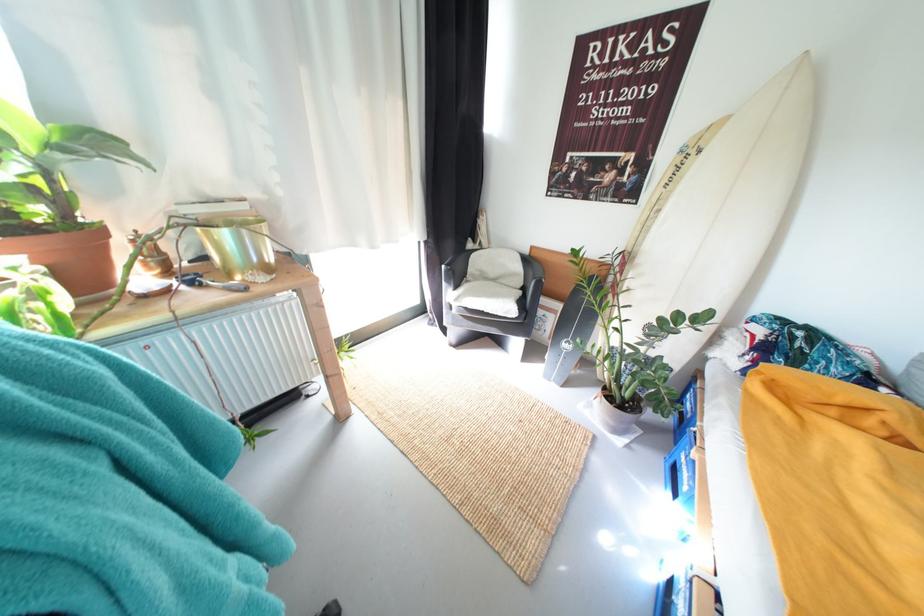
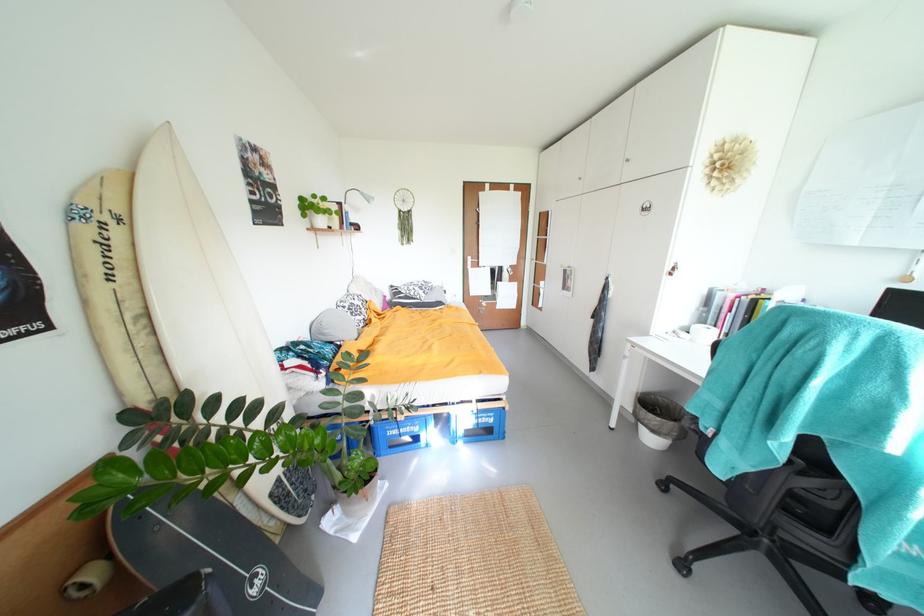
Where in the second image is the point corresponding to point (698, 487) from the first image?

(423, 428)